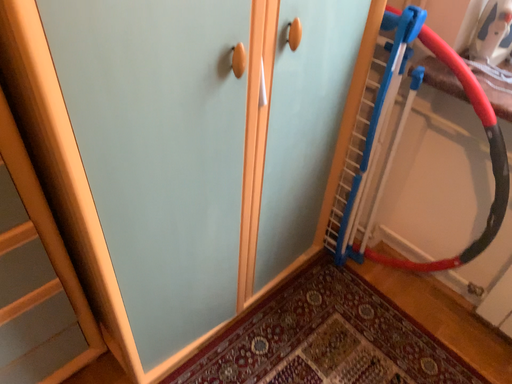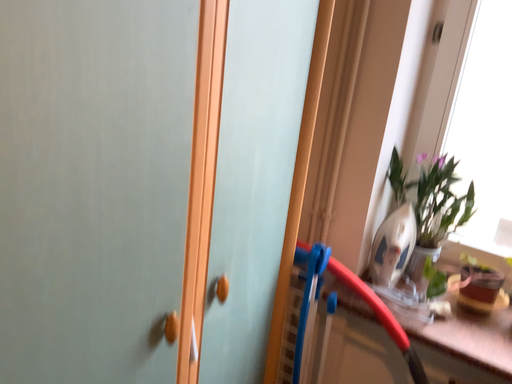
Question: How did the camera likely rotate when shooting the video?

Choices:
 (A) rotated left
 (B) rotated right

Answer: (B)